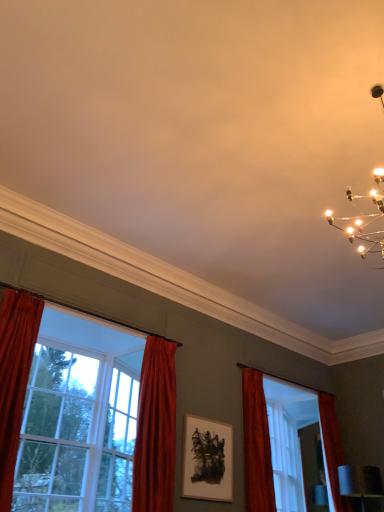
Question: Can you confirm if clear glass window at left, the 2th window positioned from the left, is positioned to the right of velvet red curtain at right, the 1th curtain viewed from the right?

Choices:
 (A) no
 (B) yes

Answer: (A)

Question: From the image's perspective, is clear glass window at left, which is the 2th window in right-to-left order, on velvet red curtain at right, the 1th curtain viewed from the right?

Choices:
 (A) no
 (B) yes

Answer: (B)

Question: From a real-world perspective, is clear glass window at left, the 2th window positioned from the left, under velvet red curtain at right, the 1th curtain viewed from the right?

Choices:
 (A) no
 (B) yes

Answer: (B)

Question: Is clear glass window at left, the 2th window positioned from the left, further to camera compared to velvet red curtain at right, the 2th curtain in the left-to-right sequence?

Choices:
 (A) no
 (B) yes

Answer: (A)

Question: Is clear glass window at left, the 2th window positioned from the left, closer to the viewer compared to velvet red curtain at right, the 1th curtain viewed from the right?

Choices:
 (A) no
 (B) yes

Answer: (B)

Question: Is clear glass window at left, the 2th window positioned from the left, positioned far away from velvet red curtain at right, the 1th curtain viewed from the right?

Choices:
 (A) no
 (B) yes

Answer: (B)

Question: Does clear glass window at left, positioned as the 1th window in left-to-right order, appear on the right side of wooden picture frame at center?

Choices:
 (A) yes
 (B) no

Answer: (B)

Question: Is clear glass window at left, the third window viewed from the right, bigger than wooden picture frame at center?

Choices:
 (A) no
 (B) yes

Answer: (B)

Question: Can you confirm if clear glass window at left, positioned as the 1th window in left-to-right order, is positioned to the left of wooden picture frame at center?

Choices:
 (A) yes
 (B) no

Answer: (A)

Question: From a real-world perspective, is clear glass window at left, the third window viewed from the right, on top of wooden picture frame at center?

Choices:
 (A) no
 (B) yes

Answer: (B)

Question: Could you tell me if clear glass window at left, positioned as the 1th window in left-to-right order, is facing wooden picture frame at center?

Choices:
 (A) no
 (B) yes

Answer: (A)

Question: Is clear glass window at left, the third window viewed from the right, closer to the viewer compared to wooden picture frame at center?

Choices:
 (A) yes
 (B) no

Answer: (A)

Question: Can you confirm if wooden picture frame at center is bigger than velvet red curtain at center, the first curtain positioned from the left?

Choices:
 (A) no
 (B) yes

Answer: (A)